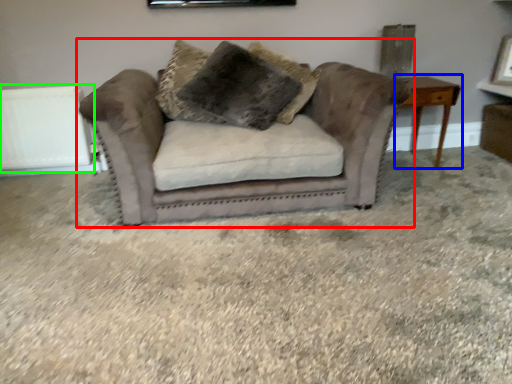
Question: Estimate the real-world distances between objects in this image. Which object is closer to studio couch (highlighted by a red box), table (highlighted by a blue box) or radiator (highlighted by a green box)?

Choices:
 (A) table
 (B) radiator

Answer: (A)